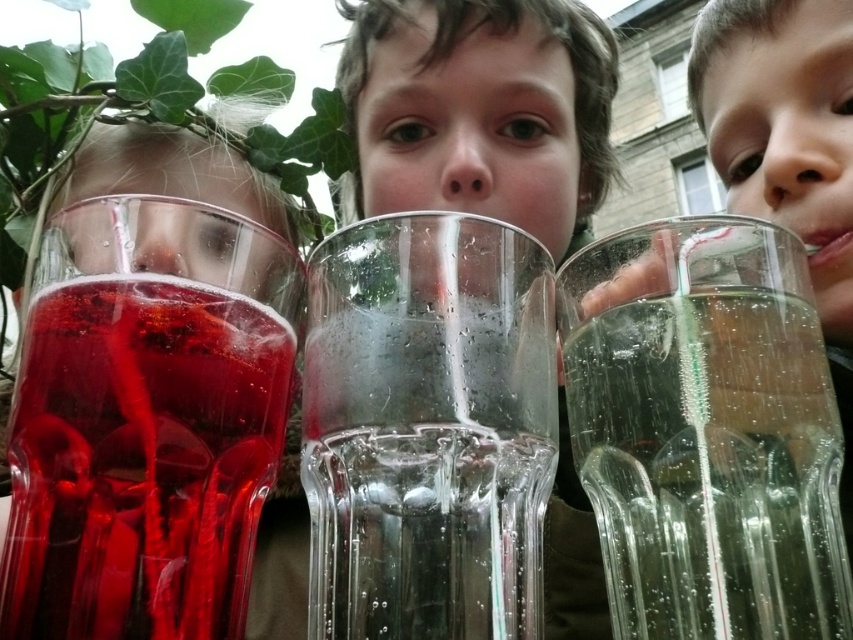
Which is above, matte glass juice at left or clear glass at center?

matte glass juice at left is higher up.

Does matte glass juice at left have a greater height compared to clear glass at center?

Correct, matte glass juice at left is much taller as clear glass at center.

Is point (173, 294) farther from camera compared to point (379, 548)?

Yes, it is behind point (379, 548).

At what (x,y) coordinates should I click in order to perform the action: click on matte glass juice at left. Please return your answer as a coordinate pair (x, y). This screenshot has height=640, width=853. Looking at the image, I should click on (141, 460).

Is transparent glass cup at center closer to the viewer compared to clear glass at center?

No, it is not.

Is transparent glass cup at center bigger than clear glass at center?

Correct, transparent glass cup at center is larger in size than clear glass at center.

Identify the location of transparent glass cup at center. This screenshot has height=640, width=853. (427, 428).

What are the coordinates of `transparent glass cup at center` in the screenshot? It's located at (427, 428).

Consider the image. How distant is clear glass at center from clear glass straw at upper center?

A distance of 1.50 meters exists between clear glass at center and clear glass straw at upper center.

Does clear glass at center come behind clear glass straw at upper center?

No, clear glass at center is in front of clear glass straw at upper center.

Who is more forward, (541,577) or (706,513)?

Point (706,513) is more forward.

Find the location of a particular element. clear glass at center is located at coordinates (426, 531).